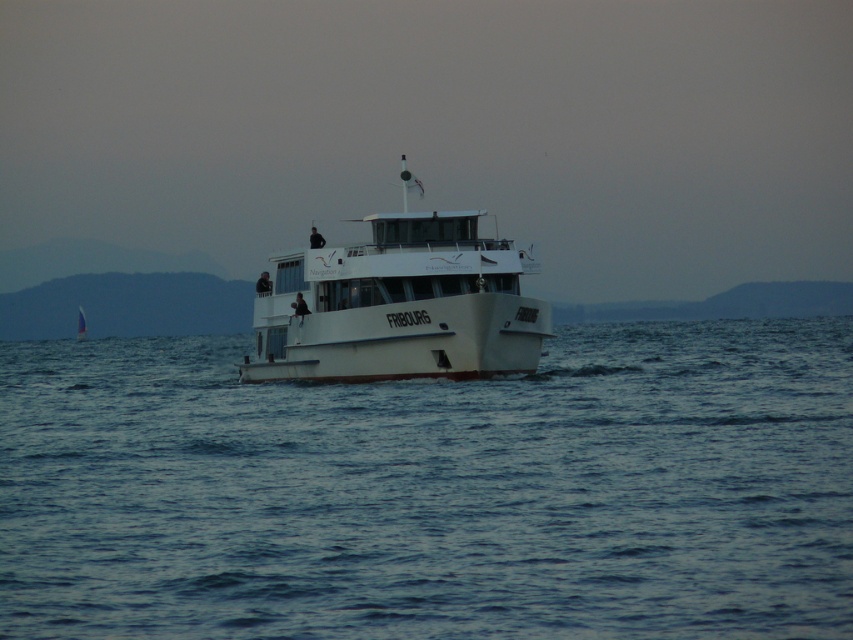
You are standing on the deck of the ferry and looking straight ahead. What do you see directly in front of you at the coordinates point (433,492)?

The point (433,492) corresponds to blue water at center.